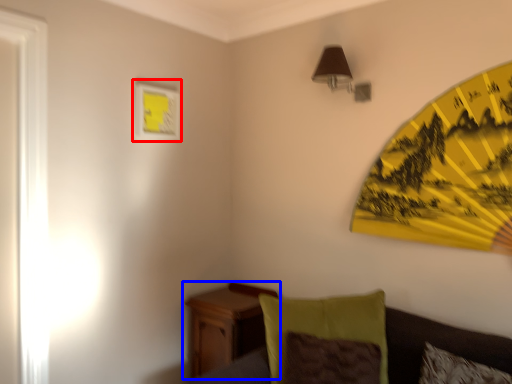
Question: Which object is further to the camera taking this photo, picture frame (highlighted by a red box) or nightstand (highlighted by a blue box)?

Choices:
 (A) picture frame
 (B) nightstand

Answer: (A)